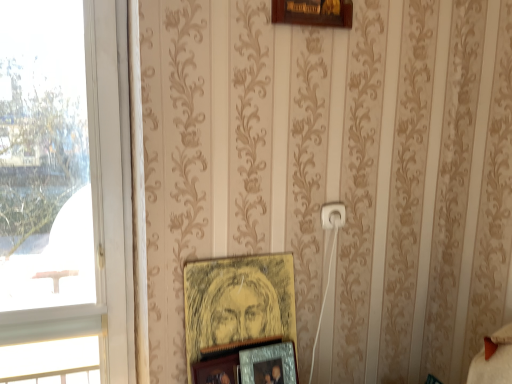
Question: Considering the relative positions of white plastic electric outlet at center and metallic silver photo frame at lower center, the 2th picture frame positioned from the bottom, in the image provided, is white plastic electric outlet at center to the right of metallic silver photo frame at lower center, the 2th picture frame positioned from the bottom, from the viewer's perspective?

Choices:
 (A) no
 (B) yes

Answer: (B)

Question: Is white plastic electric outlet at center not inside metallic silver photo frame at lower center, the 2th picture frame positioned from the bottom?

Choices:
 (A) no
 (B) yes

Answer: (B)

Question: Considering the relative sizes of white plastic electric outlet at center and metallic silver photo frame at lower center, the 2th picture frame positioned from the bottom, in the image provided, is white plastic electric outlet at center smaller than metallic silver photo frame at lower center, the 2th picture frame positioned from the bottom,?

Choices:
 (A) yes
 (B) no

Answer: (A)

Question: Is white plastic electric outlet at center positioned far away from metallic silver photo frame at lower center, the 2th picture frame positioned from the bottom?

Choices:
 (A) no
 (B) yes

Answer: (A)

Question: Could you tell me if white plastic electric outlet at center is facing metallic silver photo frame at lower center, the 2th picture frame positioned from the bottom?

Choices:
 (A) no
 (B) yes

Answer: (A)

Question: Does white plastic electric outlet at center have a lesser height compared to metallic silver photo frame at lower center, the 2th picture frame positioned from the bottom?

Choices:
 (A) yes
 (B) no

Answer: (A)

Question: Is transparent glass window at left next to metallic silver photo frame at lower center, which is the 2th picture frame from top to bottom?

Choices:
 (A) no
 (B) yes

Answer: (A)

Question: Is transparent glass window at left positioned behind metallic silver photo frame at lower center, which is the 2th picture frame from top to bottom?

Choices:
 (A) yes
 (B) no

Answer: (B)

Question: Does transparent glass window at left turn towards metallic silver photo frame at lower center, the 2th picture frame positioned from the bottom?

Choices:
 (A) yes
 (B) no

Answer: (B)

Question: Is transparent glass window at left surrounding metallic silver photo frame at lower center, the 2th picture frame positioned from the bottom?

Choices:
 (A) no
 (B) yes

Answer: (A)

Question: Considering the relative sizes of transparent glass window at left and metallic silver photo frame at lower center, which is the 2th picture frame from top to bottom, in the image provided, is transparent glass window at left shorter than metallic silver photo frame at lower center, which is the 2th picture frame from top to bottom,?

Choices:
 (A) no
 (B) yes

Answer: (A)

Question: Is transparent glass window at left at the right side of metallic silver photo frame at lower center, the 2th picture frame positioned from the bottom?

Choices:
 (A) yes
 (B) no

Answer: (B)

Question: Considering the relative sizes of white plastic electric outlet at center and wooden picture frame at lower center, the third picture frame positioned from the top, in the image provided, is white plastic electric outlet at center taller than wooden picture frame at lower center, the third picture frame positioned from the top,?

Choices:
 (A) yes
 (B) no

Answer: (B)